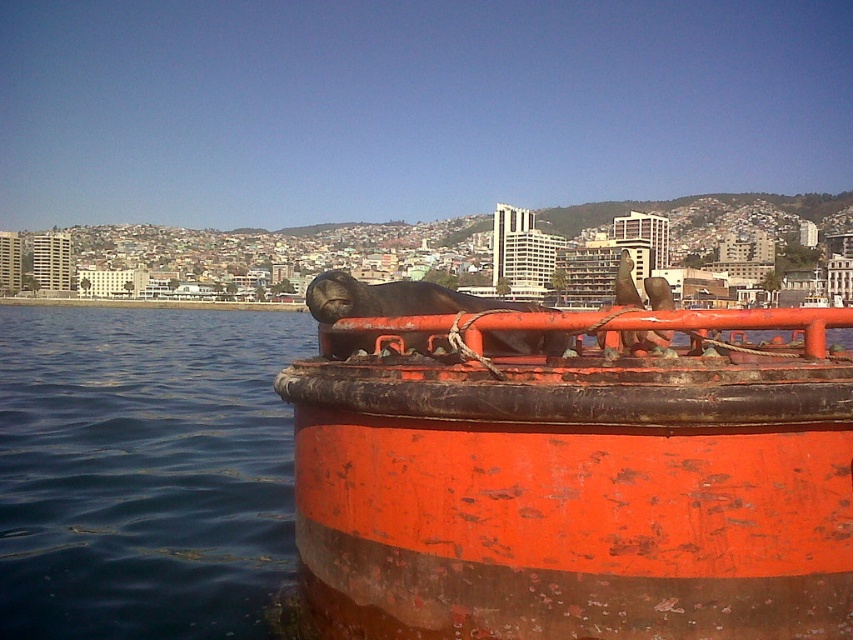
Is blue water at lower left to the right of smooth orange rail at center from the viewer's perspective?

In fact, blue water at lower left is to the left of smooth orange rail at center.

Find the location of `blue water at lower left`. blue water at lower left is located at coordinates (143, 472).

The width and height of the screenshot is (853, 640). Describe the element at coordinates (143, 472) in the screenshot. I see `blue water at lower left` at that location.

I want to click on blue water at lower left, so click(143, 472).

Is rusty metal buoy at center closer to the viewer compared to smooth orange rail at center?

Yes.

Is point (819, 310) less distant than point (451, 337)?

Yes, point (819, 310) is closer to viewer.

You are a GUI agent. You are given a task and a screenshot of the screen. Output one action in this format:
    pyautogui.click(x=<x>, y=<y>)
    Task: Click on the rusty metal buoy at center
    The height and width of the screenshot is (640, 853).
    Given the screenshot: What is the action you would take?
    pyautogui.click(x=578, y=477)

Can you confirm if rusty metal buoy at center is positioned above blue water at lower left?

No.

Can you confirm if rusty metal buoy at center is smaller than blue water at lower left?

Yes.

Identify the location of rusty metal buoy at center. (578, 477).